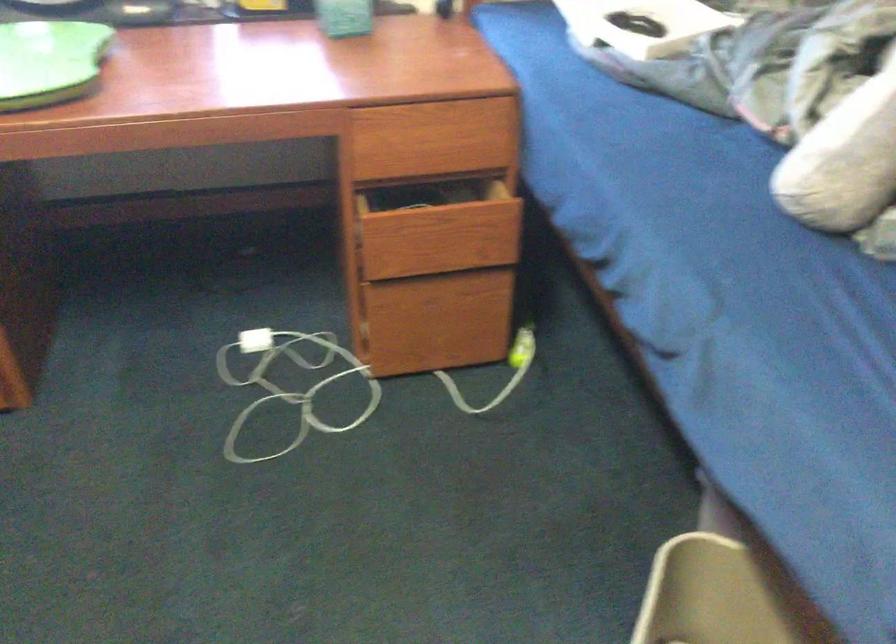
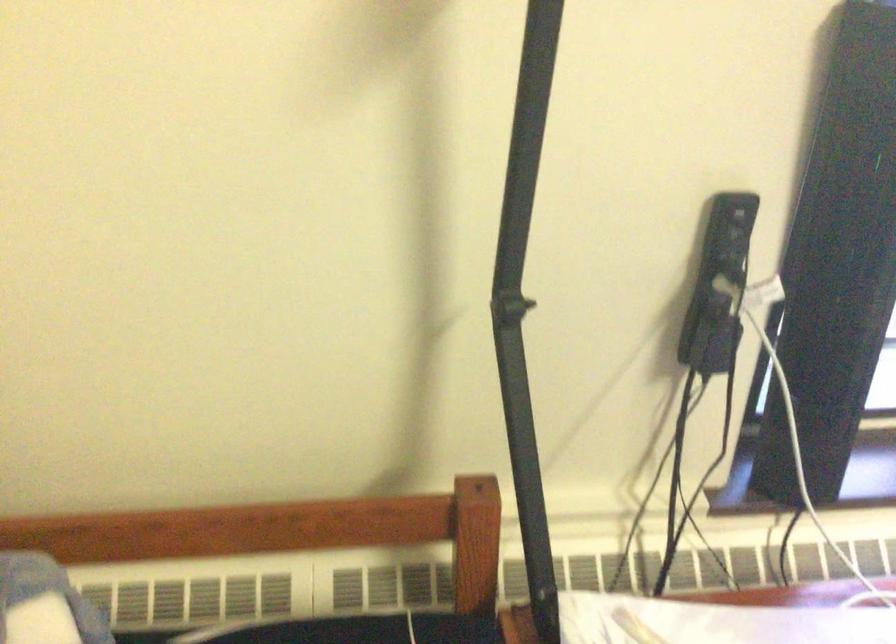
Question: In a continuous first-person perspective shot, in which direction is the camera moving?

Choices:
 (A) Left
 (B) Right
 (C) Forward
 (D) Backward

Answer: (A)